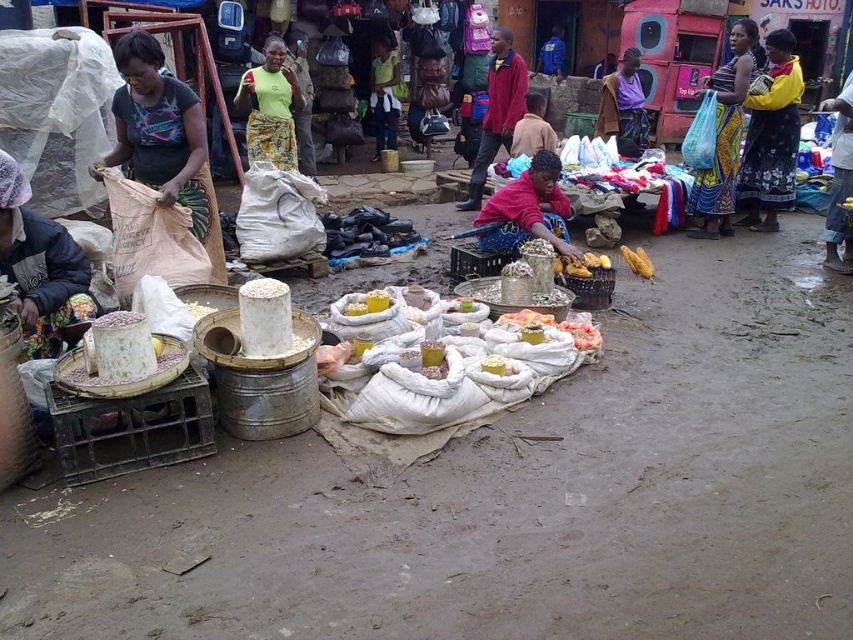
What is the object located at the coordinates point (724,134) in the market scene?

The object located at point (724,134) is the printed fabric dress at right.

You are a customer at the market and want to place a small item on the yellow fabric skirt at right and the purple fabric at center. Which surface would allow the item to be more visible to passersby?

The yellow fabric skirt at right has a greater height compared to the purple fabric at center, so placing the item there would make it more visible to passersby.